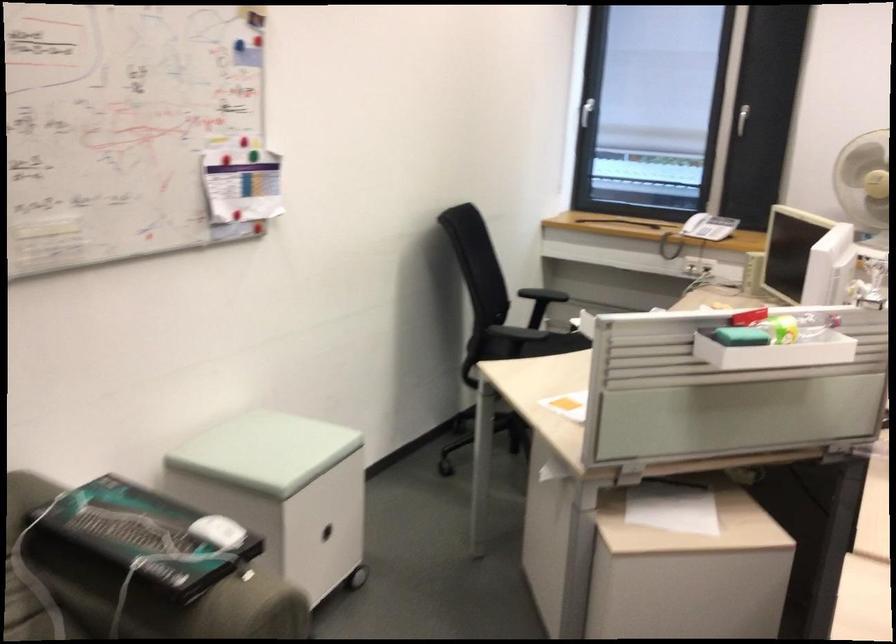
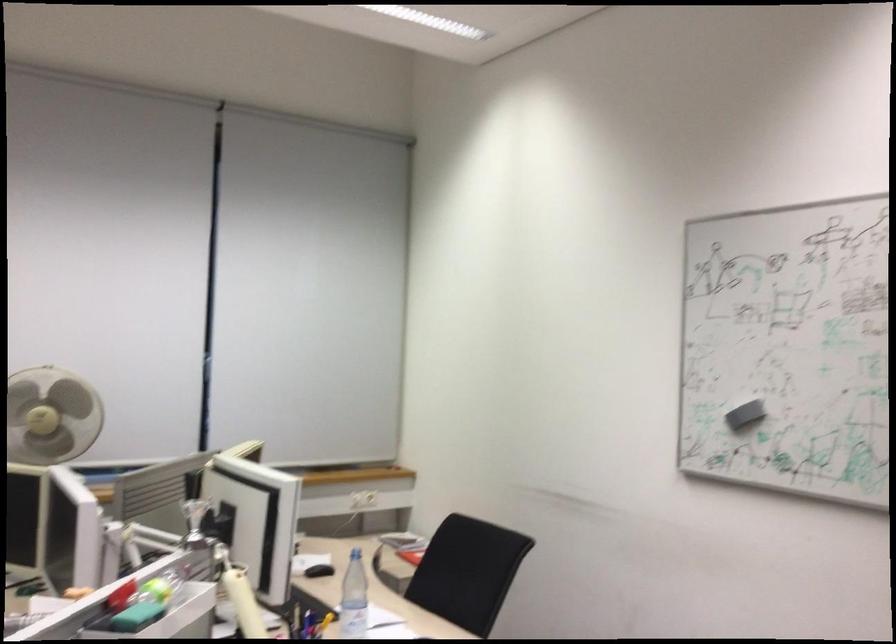
Question: The camera is either moving clockwise (left) or counter-clockwise (right) around the object. The first image is from the beginning of the video and the second image is from the end. Is the camera moving left or right when shooting the video?

Choices:
 (A) Left
 (B) Right

Answer: (A)